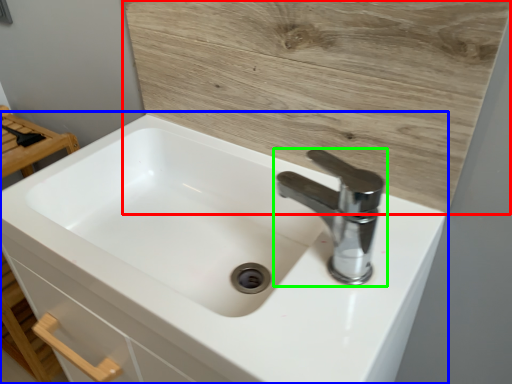
Question: Which is farther away from plywood (highlighted by a red box)? sink (highlighted by a blue box) or tap (highlighted by a green box)?

Choices:
 (A) sink
 (B) tap

Answer: (A)